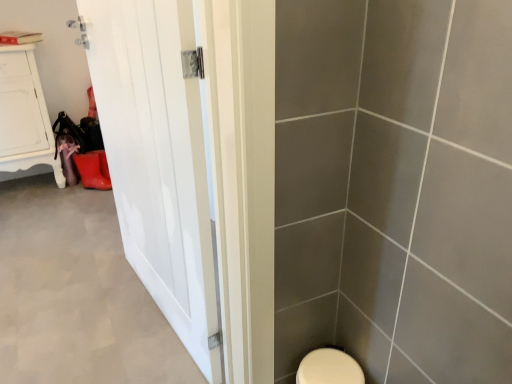
Question: From a real-world perspective, is white glossy door at left physically above white wood cabinet at upper left?

Choices:
 (A) yes
 (B) no

Answer: (A)

Question: Is white glossy door at left surrounding white wood cabinet at upper left?

Choices:
 (A) no
 (B) yes

Answer: (A)

Question: From a real-world perspective, is white glossy door at left under white wood cabinet at upper left?

Choices:
 (A) yes
 (B) no

Answer: (B)

Question: Can you confirm if white glossy door at left is wider than white wood cabinet at upper left?

Choices:
 (A) yes
 (B) no

Answer: (B)

Question: Is white glossy door at left aimed at white wood cabinet at upper left?

Choices:
 (A) no
 (B) yes

Answer: (A)

Question: Can you confirm if white glossy door at left is taller than white wood cabinet at upper left?

Choices:
 (A) yes
 (B) no

Answer: (A)

Question: Is white wood cabinet at upper left positioned in front of white matte door at left?

Choices:
 (A) yes
 (B) no

Answer: (B)

Question: Considering the relative sizes of white wood cabinet at upper left and white matte door at left in the image provided, is white wood cabinet at upper left thinner than white matte door at left?

Choices:
 (A) no
 (B) yes

Answer: (B)

Question: Is white wood cabinet at upper left facing towards white matte door at left?

Choices:
 (A) yes
 (B) no

Answer: (A)

Question: Considering the relative sizes of white wood cabinet at upper left and white matte door at left in the image provided, is white wood cabinet at upper left shorter than white matte door at left?

Choices:
 (A) yes
 (B) no

Answer: (B)

Question: Can white matte door at left be found inside white wood cabinet at upper left?

Choices:
 (A) yes
 (B) no

Answer: (B)

Question: From a real-world perspective, is white wood cabinet at upper left on white matte door at left?

Choices:
 (A) no
 (B) yes

Answer: (B)

Question: From the image's perspective, is white matte door at left on white wood cabinet at upper left?

Choices:
 (A) no
 (B) yes

Answer: (A)